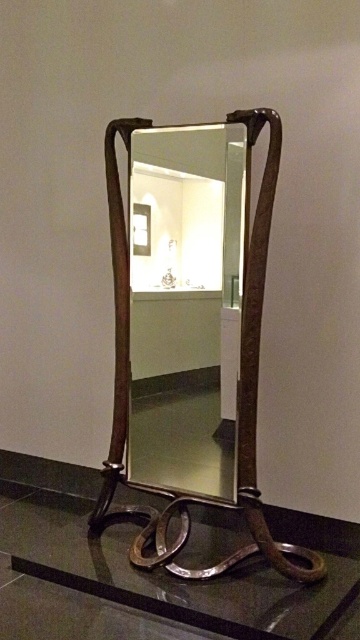
In the scene shown: Does polished wood mirror at center appear over transparent glass table at lower center?

Indeed, polished wood mirror at center is positioned over transparent glass table at lower center.

Can you confirm if polished wood mirror at center is bigger than transparent glass table at lower center?

Incorrect, polished wood mirror at center is not larger than transparent glass table at lower center.

From the picture: Who is more distant from viewer, (159, 426) or (42, 493)?

The point (42, 493) is behind.

Where is `polished wood mirror at center`? This screenshot has width=360, height=640. polished wood mirror at center is located at coordinates (185, 305).